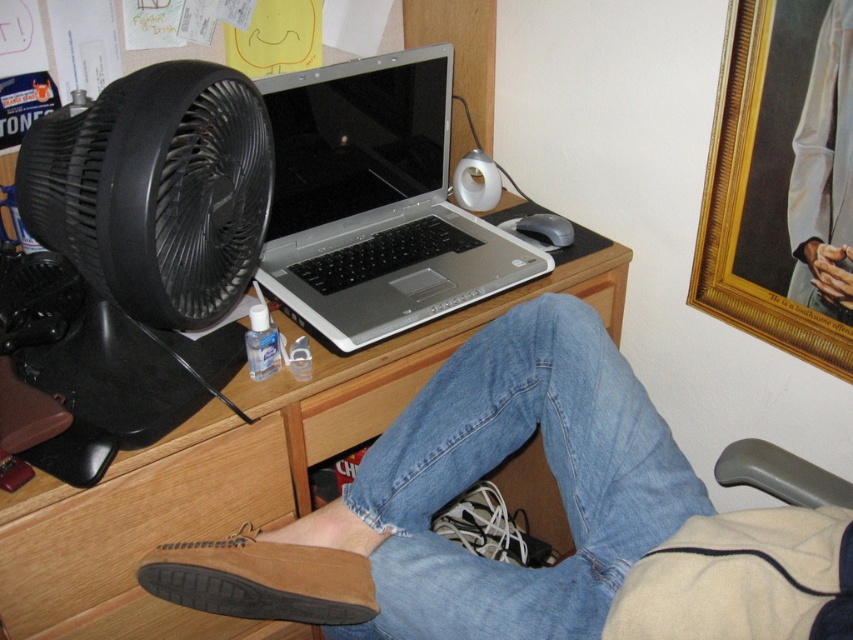
Between wooden at center and denim at center, which one has more height?

wooden at center

Which is below, wooden at center or denim at center?

denim at center

The width and height of the screenshot is (853, 640). Describe the element at coordinates (235, 474) in the screenshot. I see `wooden at center` at that location.

Locate an element on the screen. wooden at center is located at coordinates (235, 474).

Which of these two, silver/black laptop at center or brown suede shoe at lower center, stands taller?

With more height is silver/black laptop at center.

Does silver/black laptop at center have a greater width compared to brown suede shoe at lower center?

Yes.

Identify the location of silver/black laptop at center. (375, 202).

Which is below, black plastic fan at left or white satin robe at upper right?

black plastic fan at left is below.

Who is taller, black plastic fan at left or white satin robe at upper right?

With more height is black plastic fan at left.

Which is in front, point (151, 250) or point (834, 36)?

Point (151, 250)

Identify the location of black plastic fan at left. The height and width of the screenshot is (640, 853). (155, 189).